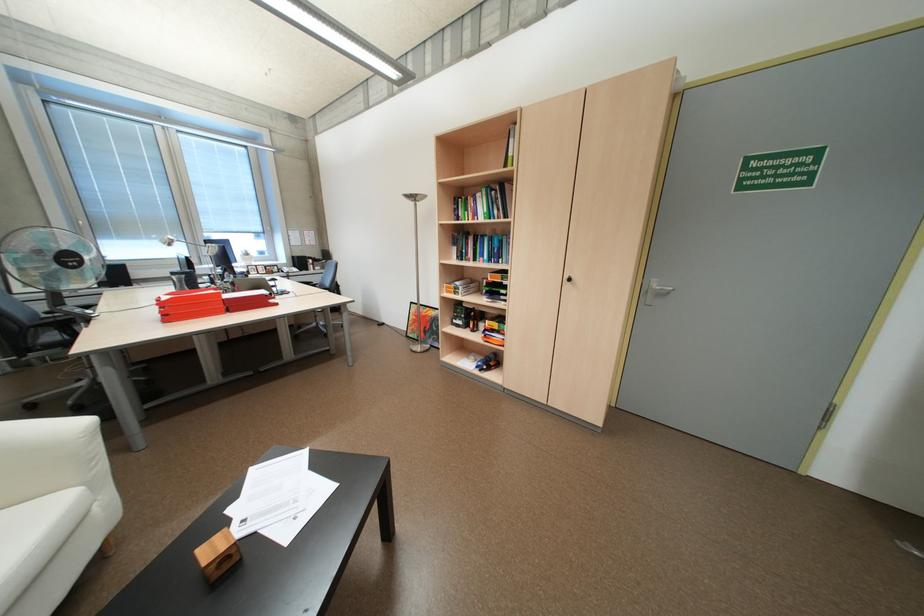
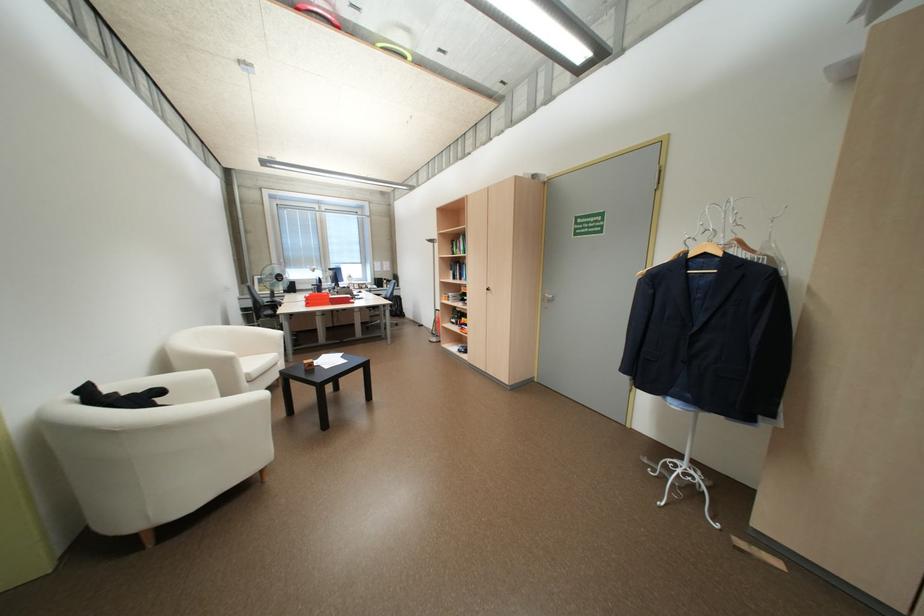
The point at (464, 261) is marked in the first image. Where is the corresponding point in the second image?

(460, 280)